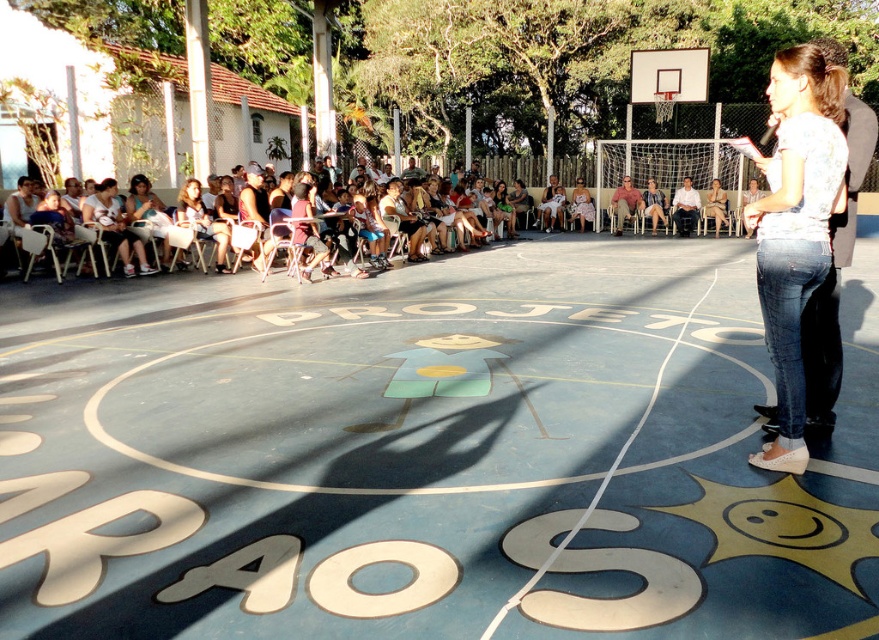
You are a photographer setting up for an event. You need to capture a photo where both the metallic silver basketball hoop at upper center and the matte pink dress at center are visible. Which object should you focus on first to ensure both are in frame?

The metallic silver basketball hoop at upper center is larger in size than the matte pink dress at center, so you should focus on the metallic silver basketball hoop at upper center first to ensure both fit within the frame.

You are standing at the center of the basketball court and want to shoot a basketball into the metallic silver basketball hoop at upper center. Based on your current position, in which direction should you aim to score a basket?

You should aim upwards because the metallic silver basketball hoop at upper center is positioned above you at point 0.761 on the vertical axis.

You are organizing an outdoor event and need to ensure that the metallic silver basketball hoop at upper center doesn not block the view of the audience seated in front of the matte pink dress at center. Based on their sizes, which object should be placed closer to the audience to avoid blocking their view?

The metallic silver basketball hoop at upper center has a larger width than the matte pink dress at center. To avoid blocking the audience view, the larger metallic silver basketball hoop at upper center should be placed closer to the audience so that the smaller matte pink dress at center is further back.